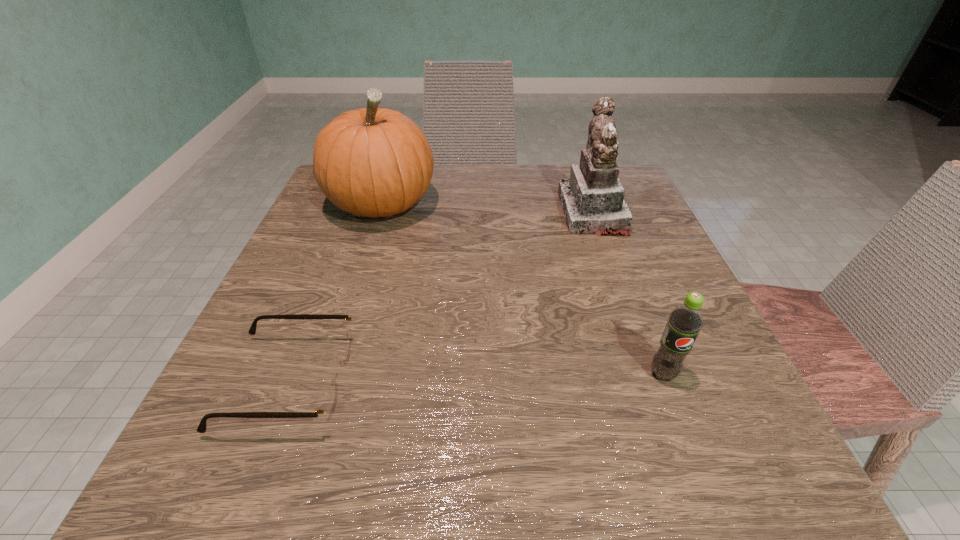
This screenshot has height=540, width=960. I want to click on pumpkin, so click(373, 162).

The image size is (960, 540). Identify the location of figurine. (592, 200).

Locate an element on the screen. The image size is (960, 540). the second shortest object is located at coordinates (685, 321).

At what (x,y) coordinates should I click in order to perform the action: click on spectacles. Please return your answer as a coordinate pair (x, y). This screenshot has width=960, height=540. Looking at the image, I should click on (329, 403).

Identify the location of vacant area situated on the stem of the pumpkin. (360, 272).

Image resolution: width=960 pixels, height=540 pixels. I want to click on free space located 0.270m on the front-facing side of the figurine, so pyautogui.click(x=439, y=213).

This screenshot has width=960, height=540. In order to click on vacant point located 0.140m on the front-facing side of the figurine in this screenshot , I will do `click(498, 213)`.

Where is `free space located on the front-facing side of the figurine`? This screenshot has height=540, width=960. free space located on the front-facing side of the figurine is located at coordinates (470, 213).

I want to click on free space located on the front label of the third tallest object, so click(703, 478).

Locate an element on the screen. The height and width of the screenshot is (540, 960). vacant space located at the hinge ends of the shortest object is located at coordinates tap(414, 382).